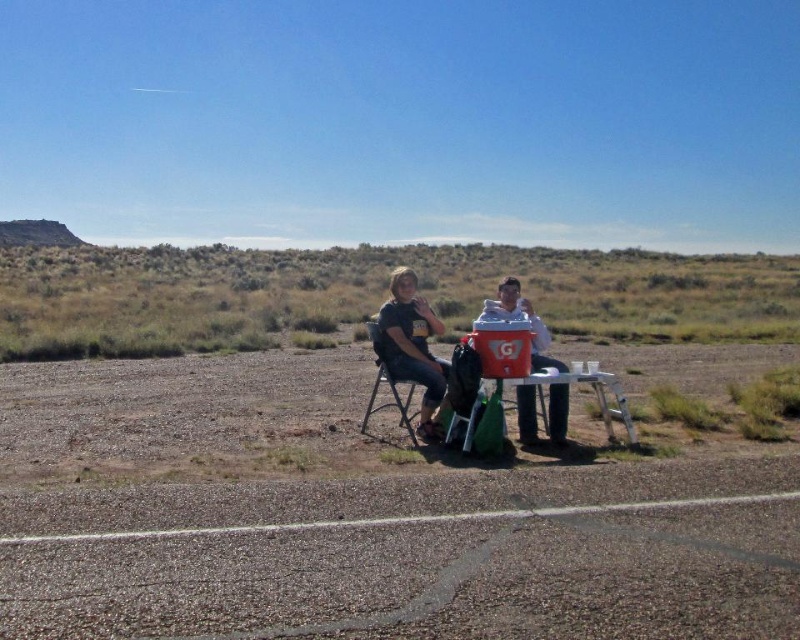
Question: Which of the following is the farthest from the observer?

Choices:
 (A) white fabric shirt at center
 (B) matte black shirt at center
 (C) matte plastic table at center

Answer: (A)

Question: Does matte black shirt at center have a lesser width compared to matte plastic table at center?

Choices:
 (A) no
 (B) yes

Answer: (A)

Question: Is dirt field at center below matte plastic table at center?

Choices:
 (A) no
 (B) yes

Answer: (B)

Question: Can you confirm if dirt field at center is wider than matte black shirt at center?

Choices:
 (A) no
 (B) yes

Answer: (B)

Question: Which point is farther to the camera?

Choices:
 (A) dirt field at center
 (B) white fabric shirt at center
 (C) matte black shirt at center

Answer: (B)

Question: Which object is closer to the camera taking this photo?

Choices:
 (A) white fabric shirt at center
 (B) matte plastic table at center
 (C) black plastic chair at center
 (D) matte black shirt at center

Answer: (B)